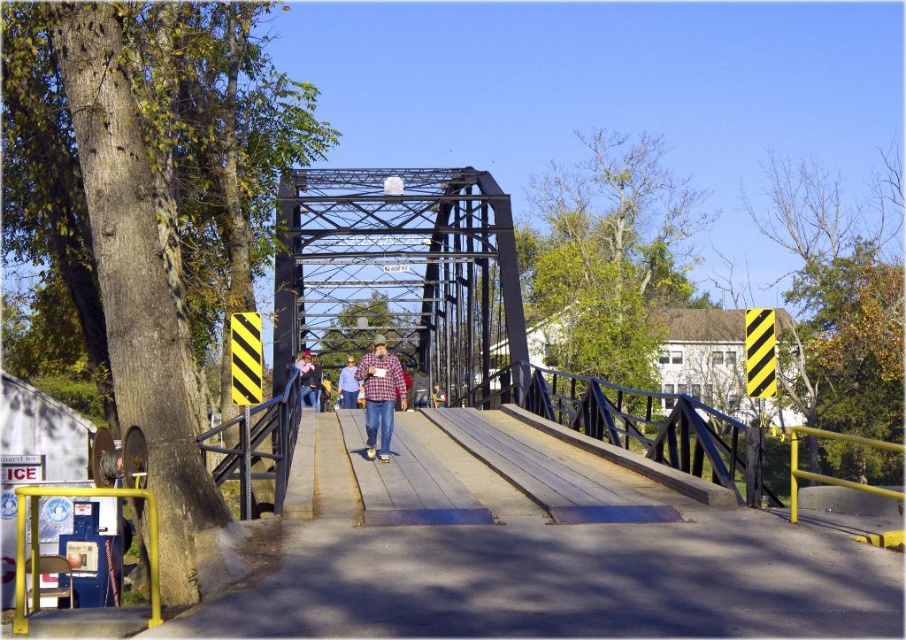
Can you confirm if black metal bridge at center is smaller than matte pink shirt at center?

No, black metal bridge at center is not smaller than matte pink shirt at center.

Where is `black metal bridge at center`? The image size is (906, 640). black metal bridge at center is located at coordinates (400, 268).

Where is `black metal bridge at center`? This screenshot has height=640, width=906. black metal bridge at center is located at coordinates pos(400,268).

Where is `black metal bridge at center`? black metal bridge at center is located at coordinates (400, 268).

Does black metal bridge at center appear over denim jacket at center?

Indeed, black metal bridge at center is positioned over denim jacket at center.

Which is in front, point (305, 298) or point (352, 384)?

Positioned in front is point (352, 384).

Locate an element on the screen. black metal bridge at center is located at coordinates (400, 268).

Who is taller, plaid fabric shirt at center or denim jacket at center?

Standing taller between the two is plaid fabric shirt at center.

Is point (365, 429) positioned behind point (353, 378)?

No, it is in front of (353, 378).

Image resolution: width=906 pixels, height=640 pixels. I want to click on plaid fabric shirt at center, so click(381, 396).